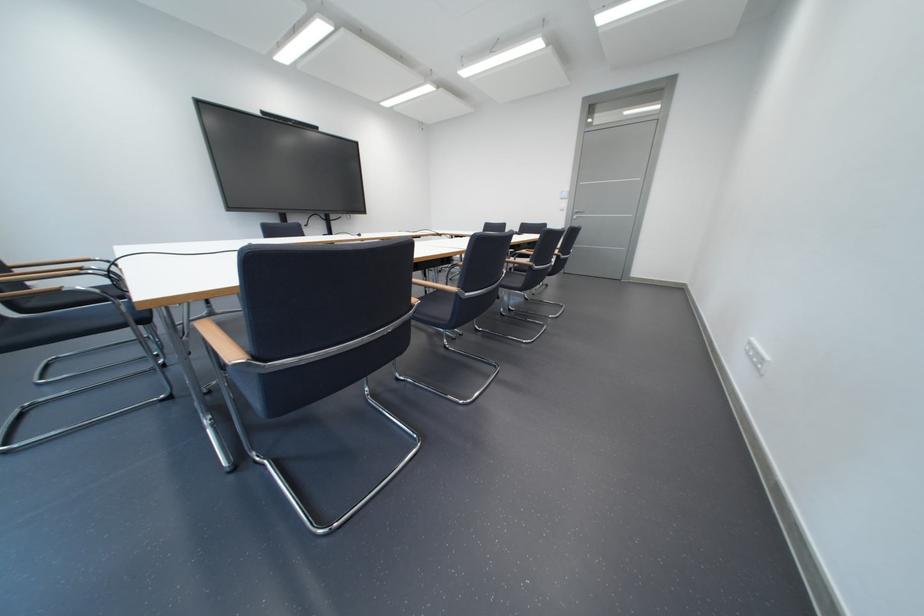
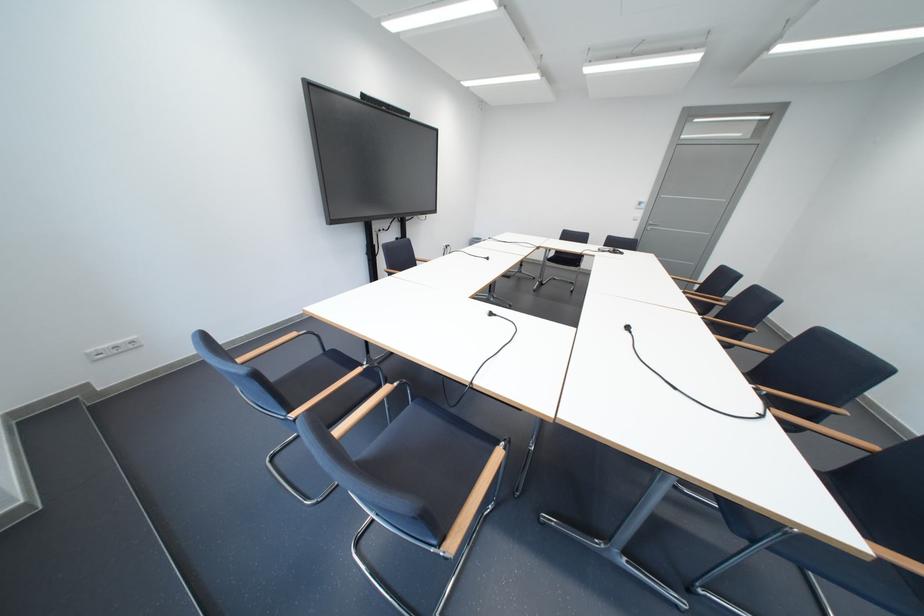
Question: Which direction would the cameraman need to move to produce the second image? Reply with the corresponding letter.

Choices:
 (A) Left
 (B) Right
 (C) Forward
 (D) Backward

Answer: (A)